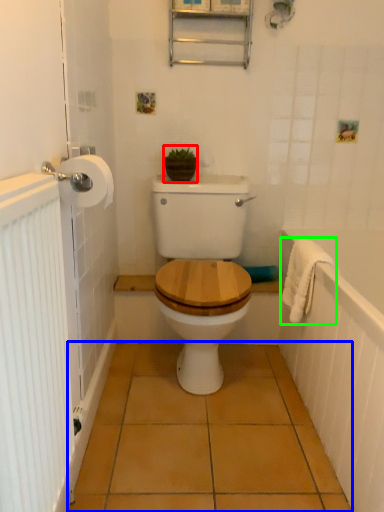
Question: Which is farther away from plant (highlighted by a red box)? ceramic tile (highlighted by a blue box) or bath towel (highlighted by a green box)?

Choices:
 (A) ceramic tile
 (B) bath towel

Answer: (A)